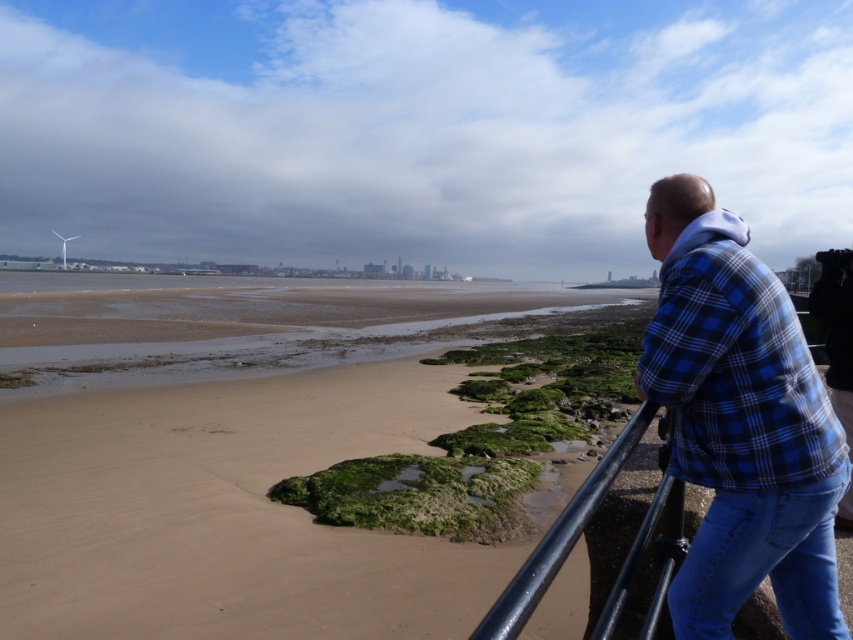
Is the position of sandy brown beach at lower left less distant than that of blue plaid shirt at right?

No.

Can you confirm if sandy brown beach at lower left is positioned below blue plaid shirt at right?

No, sandy brown beach at lower left is not below blue plaid shirt at right.

Is point (39, 406) positioned after point (650, 250)?

Yes, point (39, 406) is farther from viewer.

The height and width of the screenshot is (640, 853). In order to click on sandy brown beach at lower left in this screenshot , I will do `click(241, 452)`.

Is blue plaid shirt at right further to camera compared to blue denim jeans at lower right?

No, it is in front of blue denim jeans at lower right.

Does blue plaid shirt at right have a larger size compared to blue denim jeans at lower right?

Yes, blue plaid shirt at right is bigger than blue denim jeans at lower right.

What do you see at coordinates (740, 422) in the screenshot? The width and height of the screenshot is (853, 640). I see `blue plaid shirt at right` at bounding box center [740, 422].

The height and width of the screenshot is (640, 853). I want to click on blue plaid shirt at right, so click(x=740, y=422).

Does blue plaid shirt at right have a greater height compared to black metal rail at lower right?

Correct, blue plaid shirt at right is much taller as black metal rail at lower right.

Between blue plaid shirt at right and black metal rail at lower right, which one is positioned higher?

blue plaid shirt at right

Is point (706, 515) closer to camera compared to point (549, 563)?

No, it is not.

The height and width of the screenshot is (640, 853). Find the location of `blue plaid shirt at right`. blue plaid shirt at right is located at coordinates (740, 422).